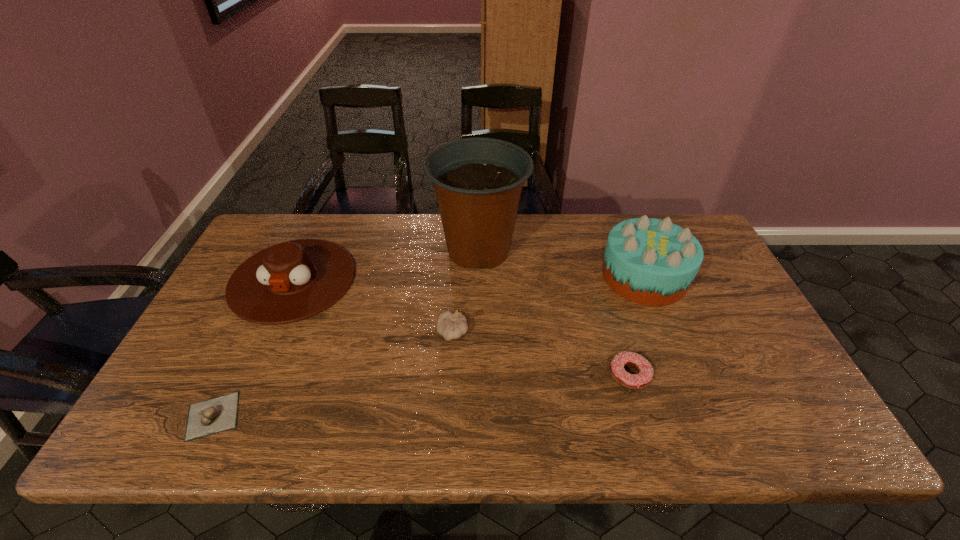
The width and height of the screenshot is (960, 540). I want to click on the tallest object, so pyautogui.click(x=478, y=181).

Image resolution: width=960 pixels, height=540 pixels. Find the location of `cake`. cake is located at coordinates (649, 261).

Where is `cowboy hat`? cowboy hat is located at coordinates (291, 281).

Where is `the taller garlic`? The image size is (960, 540). the taller garlic is located at coordinates click(x=451, y=326).

This screenshot has height=540, width=960. What are the coordinates of `the right garlic` in the screenshot? It's located at (451, 326).

Identify the location of the fifth tallest object. The height and width of the screenshot is (540, 960). (641, 380).

Locate an element on the screen. The width and height of the screenshot is (960, 540). the shortest object is located at coordinates (212, 416).

The width and height of the screenshot is (960, 540). I want to click on the shorter garlic, so click(x=212, y=416).

Where is `free space located on the right of the flowerpot`? Image resolution: width=960 pixels, height=540 pixels. free space located on the right of the flowerpot is located at coordinates (601, 250).

You are a GUI agent. You are given a task and a screenshot of the screen. Output one action in this format:
    pyautogui.click(x=<x>, y=<y>)
    Task: Click on the vacant space located on the front of the fifth shortest object
    
    Given the screenshot: What is the action you would take?
    pyautogui.click(x=673, y=348)